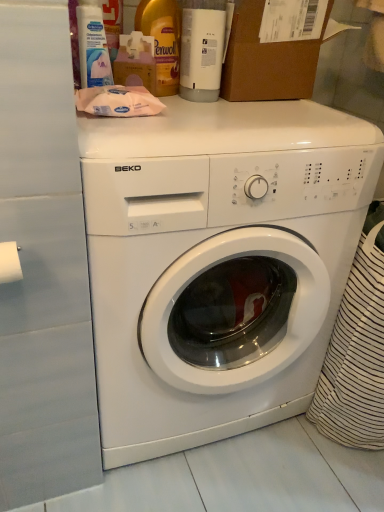
Question: From the image's perspective, would you say brown cardboard box at upper center is shown under yellow plastic bottle at upper center, which ranks as the 1th bottle in left-to-right order?

Choices:
 (A) no
 (B) yes

Answer: (A)

Question: Considering the relative sizes of brown cardboard box at upper center and yellow plastic bottle at upper center, which ranks as the 1th bottle in left-to-right order, in the image provided, is brown cardboard box at upper center bigger than yellow plastic bottle at upper center, which ranks as the 1th bottle in left-to-right order,?

Choices:
 (A) no
 (B) yes

Answer: (B)

Question: Considering the relative sizes of brown cardboard box at upper center and yellow plastic bottle at upper center, which ranks as the 1th bottle in left-to-right order, in the image provided, is brown cardboard box at upper center thinner than yellow plastic bottle at upper center, which ranks as the 1th bottle in left-to-right order,?

Choices:
 (A) yes
 (B) no

Answer: (B)

Question: Could you tell me if brown cardboard box at upper center is facing yellow plastic bottle at upper center, the 2th bottle from the right?

Choices:
 (A) yes
 (B) no

Answer: (B)

Question: Is brown cardboard box at upper center to the right of yellow plastic bottle at upper center, the 2th bottle from the right, from the viewer's perspective?

Choices:
 (A) yes
 (B) no

Answer: (A)

Question: From a real-world perspective, relative to white plastic bottle at upper left, is white glossy washing machine at center vertically above or below?

Choices:
 (A) below
 (B) above

Answer: (A)

Question: Is white glossy washing machine at center wider or thinner than white plastic bottle at upper left?

Choices:
 (A) wide
 (B) thin

Answer: (A)

Question: Is white glossy washing machine at center in front of or behind white plastic bottle at upper left in the image?

Choices:
 (A) behind
 (B) front

Answer: (B)

Question: Looking at the image, does white glossy washing machine at center seem bigger or smaller compared to white plastic bottle at upper left?

Choices:
 (A) small
 (B) big

Answer: (B)

Question: Is point (162, 2) closer or farther from the camera than point (104, 76)?

Choices:
 (A) closer
 (B) farther

Answer: (B)

Question: From the image's perspective, is yellow plastic bottle at upper center, which ranks as the 1th bottle in left-to-right order, above or below white plastic bottle at upper left?

Choices:
 (A) above
 (B) below

Answer: (A)

Question: In the image, is yellow plastic bottle at upper center, which ranks as the 1th bottle in left-to-right order, positioned in front of or behind white plastic bottle at upper left?

Choices:
 (A) front
 (B) behind

Answer: (B)

Question: From their relative heights in the image, would you say yellow plastic bottle at upper center, the 2th bottle from the right, is taller or shorter than white plastic bottle at upper left?

Choices:
 (A) tall
 (B) short

Answer: (A)

Question: Looking at the image, does white plastic bottle at upper left seem bigger or smaller compared to white matte toilet paper at left?

Choices:
 (A) small
 (B) big

Answer: (B)

Question: From the image's perspective, is white plastic bottle at upper left located above or below white matte toilet paper at left?

Choices:
 (A) above
 (B) below

Answer: (A)